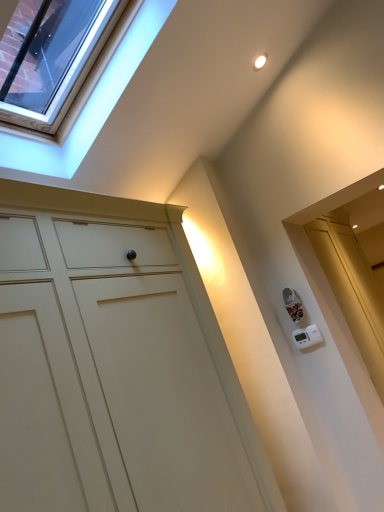
Question: In terms of size, does matte white cupboard at center appear bigger or smaller than clear glass window at upper left?

Choices:
 (A) big
 (B) small

Answer: (A)

Question: From a real-world perspective, is matte white cupboard at center physically located above or below clear glass window at upper left?

Choices:
 (A) below
 (B) above

Answer: (A)

Question: Is matte white cupboard at center in front of or behind clear glass window at upper left in the image?

Choices:
 (A) front
 (B) behind

Answer: (A)

Question: Visually, is clear glass window at upper left positioned to the left or to the right of matte white cupboard at center?

Choices:
 (A) right
 (B) left

Answer: (B)

Question: From the image's perspective, is clear glass window at upper left located above or below matte white cupboard at center?

Choices:
 (A) below
 (B) above

Answer: (B)

Question: From a real-world perspective, is clear glass window at upper left physically located above or below matte white cupboard at center?

Choices:
 (A) below
 (B) above

Answer: (B)

Question: Is point click(x=26, y=33) closer or farther from the camera than point click(x=62, y=394)?

Choices:
 (A) farther
 (B) closer

Answer: (A)